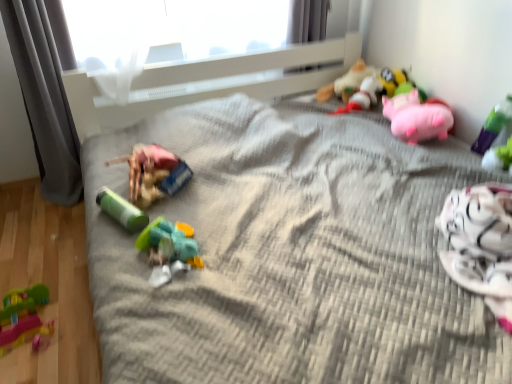
At what (x,y) coordinates should I click in order to perform the action: click on pink plush pig at upper right, which is the third toy in right-to-left order. Please return your answer as a coordinate pair (x, y). Looking at the image, I should click on (417, 117).

What do you see at coordinates (44, 99) in the screenshot?
I see `gray fabric curtain at left, which is the first curtain in left-to-right order` at bounding box center [44, 99].

Identify the location of green plastic toy at center-left, which is counted as the 2th toy, starting from the left. (121, 210).

This screenshot has height=384, width=512. Identify the location of pink plush pig at upper right, placed as the 5th toy when sorted from left to right. (417, 117).

Does pink plush pig at upper right, placed as the 5th toy when sorted from left to right, have a lesser height compared to green plastic toy at center-left, acting as the 6th toy starting from the right?

In fact, pink plush pig at upper right, placed as the 5th toy when sorted from left to right, may be taller than green plastic toy at center-left, acting as the 6th toy starting from the right.

Locate an element on the screen. The width and height of the screenshot is (512, 384). toy that is the 3rd one when counting upward from the green plastic toy at center-left, which is counted as the 2th toy, starting from the left (from the image's perspective) is located at coordinates (417, 117).

Is pink plush pig at upper right, placed as the 5th toy when sorted from left to right, inside the boundaries of green plastic toy at upper right, marked as the 7th toy in a left-to-right arrangement, or outside?

pink plush pig at upper right, placed as the 5th toy when sorted from left to right, is located beyond the bounds of green plastic toy at upper right, marked as the 7th toy in a left-to-right arrangement.

Looking at this image, does pink plush pig at upper right, placed as the 5th toy when sorted from left to right, have a lesser width compared to green plastic toy at upper right, arranged as the 1th toy when viewed from the right?

Incorrect, the width of pink plush pig at upper right, placed as the 5th toy when sorted from left to right, is not less than that of green plastic toy at upper right, arranged as the 1th toy when viewed from the right.

Is point (396, 112) closer or farther from the camera than point (475, 143)?

Point (396, 112) is positioned farther from the camera compared to point (475, 143).

Which object is positioned more to the left, pink plush pig at upper right, placed as the 5th toy when sorted from left to right, or green plastic toy at upper right, marked as the 7th toy in a left-to-right arrangement?

pink plush pig at upper right, placed as the 5th toy when sorted from left to right.

The width and height of the screenshot is (512, 384). I want to click on curtain that is the 2nd object above the rubberized green and pink toy at lower left, which appears as the 7th toy when viewed from the right (from a real-world perspective), so click(x=307, y=21).

Is rubberized green and pink toy at lower left, which appears as the 7th toy when viewed from the right, bigger or smaller than gray fabric curtain at upper center, the 1th curtain when ordered from right to left?

Considering their sizes, rubberized green and pink toy at lower left, which appears as the 7th toy when viewed from the right, takes up less space than gray fabric curtain at upper center, the 1th curtain when ordered from right to left.

Is rubberized green and pink toy at lower left, the 1th toy when ordered from left to right, taller or shorter than gray fabric curtain at upper center, the 1th curtain when ordered from right to left?

rubberized green and pink toy at lower left, the 1th toy when ordered from left to right, is shorter than gray fabric curtain at upper center, the 1th curtain when ordered from right to left.

Which of these two, rubberized green and pink toy at lower left, the 1th toy when ordered from left to right, or gray fabric curtain at upper center, marked as the 2th curtain in a left-to-right arrangement, is wider?

Wider between the two is rubberized green and pink toy at lower left, the 1th toy when ordered from left to right.

Can you confirm if green plastic toy at upper right, arranged as the 1th toy when viewed from the right, is smaller than soft plush bee at upper right, arranged as the 6th toy when viewed from the left?

No.

Looking at this image, how many degrees apart are the facing directions of green plastic toy at upper right, marked as the 7th toy in a left-to-right arrangement, and soft plush bee at upper right, marked as the second toy in a right-to-left arrangement?

green plastic toy at upper right, marked as the 7th toy in a left-to-right arrangement, and soft plush bee at upper right, marked as the second toy in a right-to-left arrangement, are facing 0.858 degrees away from each other.

From the image's perspective, which toy is the 2nd one above the green plastic toy at upper right, marked as the 7th toy in a left-to-right arrangement? Please provide its 2D coordinates.

[(398, 83)]

From the image's perspective, is green plastic toy at upper right, arranged as the 1th toy when viewed from the right, below soft plush bee at upper right, marked as the second toy in a right-to-left arrangement?

Yes, from the image's perspective, green plastic toy at upper right, arranged as the 1th toy when viewed from the right, is beneath soft plush bee at upper right, marked as the second toy in a right-to-left arrangement.

Considering the positions of point (357, 78) and point (483, 130), is point (357, 78) closer or farther from the camera than point (483, 130)?

Point (357, 78).

From the image's perspective, would you say soft plush toy at upper right, the fourth toy when ordered from right to left, is shown under green plastic toy at upper right, marked as the 7th toy in a left-to-right arrangement?

No, from the image's perspective, soft plush toy at upper right, the fourth toy when ordered from right to left, is not beneath green plastic toy at upper right, marked as the 7th toy in a left-to-right arrangement.

Is soft plush toy at upper right, the fourth toy when ordered from right to left, bigger than green plastic toy at upper right, arranged as the 1th toy when viewed from the right?

Yes.

Is green plastic toy at upper right, arranged as the 1th toy when viewed from the right, a part of soft plush toy at upper right, the fourth toy when ordered from right to left?

No.

From a real-world perspective, does soft plush bee at upper right, arranged as the 6th toy when viewed from the left, sit lower than gray fabric curtain at left, which is the first curtain in left-to-right order?

Yes.

Can you tell me how much soft plush bee at upper right, marked as the second toy in a right-to-left arrangement, and gray fabric curtain at left, which appears as the 2th curtain when viewed from the right, differ in facing direction?

There is a 91-degree angle between the facing directions of soft plush bee at upper right, marked as the second toy in a right-to-left arrangement, and gray fabric curtain at left, which appears as the 2th curtain when viewed from the right.

From the image's perspective, is soft plush bee at upper right, marked as the second toy in a right-to-left arrangement, located beneath gray fabric curtain at left, which is the first curtain in left-to-right order?

No.

Between soft plush bee at upper right, marked as the second toy in a right-to-left arrangement, and gray fabric curtain at left, which is the first curtain in left-to-right order, which one has smaller width?

Thinner between the two is soft plush bee at upper right, marked as the second toy in a right-to-left arrangement.

From the image's perspective, which one is positioned lower, rubber duck at center, the fifth toy viewed from the right, or soft plush toy at upper right, the fourth toy when ordered from right to left?

rubber duck at center, the fifth toy viewed from the right, appears lower in the image.

Which point is more distant from viewer, [145,169] or [319,97]?

The point [319,97] is behind.

Does rubber duck at center, the fifth toy viewed from the right, turn towards soft plush toy at upper right, the fourth toy when ordered from right to left?

No, rubber duck at center, the fifth toy viewed from the right, is not turned towards soft plush toy at upper right, the fourth toy when ordered from right to left.

Would you say rubber duck at center, the fifth toy viewed from the right, is outside soft plush toy at upper right, the fourth toy when ordered from right to left?

Indeed, rubber duck at center, the fifth toy viewed from the right, is completely outside soft plush toy at upper right, the fourth toy when ordered from right to left.

Where is `toy that is the 3rd object to the left of the pink plush pig at upper right, placed as the 5th toy when sorted from left to right, starting at the anchor`? toy that is the 3rd object to the left of the pink plush pig at upper right, placed as the 5th toy when sorted from left to right, starting at the anchor is located at coordinates (121, 210).

Where is `the 1st toy in front of the pink plush pig at upper right, placed as the 5th toy when sorted from left to right, counting from the anchor's position`? This screenshot has width=512, height=384. the 1st toy in front of the pink plush pig at upper right, placed as the 5th toy when sorted from left to right, counting from the anchor's position is located at coordinates (493, 125).

Looking at the image, which one is located further to gray fabric curtain at upper center, marked as the 2th curtain in a left-to-right arrangement, rubberized green and pink toy at lower left, the 1th toy when ordered from left to right, or green plastic toy at center-left, which is counted as the 2th toy, starting from the left?

The object further to gray fabric curtain at upper center, marked as the 2th curtain in a left-to-right arrangement, is rubberized green and pink toy at lower left, the 1th toy when ordered from left to right.

Considering their positions, is gray fabric curtain at left, which appears as the 2th curtain when viewed from the right, positioned further to pink plush pig at upper right, which is the third toy in right-to-left order, than soft plush bee at upper right, arranged as the 6th toy when viewed from the left?

Among the two, gray fabric curtain at left, which appears as the 2th curtain when viewed from the right, is located further to pink plush pig at upper right, which is the third toy in right-to-left order.

Which object lies nearer to the anchor point green plastic toy at center-left, which is counted as the 2th toy, starting from the left, rubberized green and pink toy at lower left, the 1th toy when ordered from left to right, or gray fabric curtain at left, which is the first curtain in left-to-right order?

rubberized green and pink toy at lower left, the 1th toy when ordered from left to right, is closer to green plastic toy at center-left, which is counted as the 2th toy, starting from the left.

When comparing their distances from rubberized green and pink toy at lower left, the 1th toy when ordered from left to right, does gray fabric curtain at left, which appears as the 2th curtain when viewed from the right, or soft plush bee at upper right, arranged as the 6th toy when viewed from the left, seem closer?

gray fabric curtain at left, which appears as the 2th curtain when viewed from the right, is closer to rubberized green and pink toy at lower left, the 1th toy when ordered from left to right.

Which object lies further to the anchor point gray fabric curtain at upper center, marked as the 2th curtain in a left-to-right arrangement, soft plush bee at upper right, marked as the second toy in a right-to-left arrangement, or rubber duck at center, acting as the third toy starting from the left?

rubber duck at center, acting as the third toy starting from the left, is further to gray fabric curtain at upper center, marked as the 2th curtain in a left-to-right arrangement.

Estimate the real-world distances between objects in this image. Which object is further from green plastic toy at center-left, which is counted as the 2th toy, starting from the left, soft plush toy at upper right, which ranks as the 4th toy in left-to-right order, or pink plush pig at upper right, which is the third toy in right-to-left order?

Based on the image, soft plush toy at upper right, which ranks as the 4th toy in left-to-right order, appears to be further to green plastic toy at center-left, which is counted as the 2th toy, starting from the left.

Based on their spatial positions, is gray fabric curtain at left, which is the first curtain in left-to-right order, or pink plush pig at upper right, which is the third toy in right-to-left order, closer to gray fabric curtain at upper center, marked as the 2th curtain in a left-to-right arrangement?

pink plush pig at upper right, which is the third toy in right-to-left order, is positioned closer to the anchor gray fabric curtain at upper center, marked as the 2th curtain in a left-to-right arrangement.

Which object lies nearer to the anchor point green plastic toy at upper right, marked as the 7th toy in a left-to-right arrangement, gray fabric curtain at upper center, marked as the 2th curtain in a left-to-right arrangement, or soft plush bee at upper right, arranged as the 6th toy when viewed from the left?

Result: Among the two, soft plush bee at upper right, arranged as the 6th toy when viewed from the left, is located nearer to green plastic toy at upper right, marked as the 7th toy in a left-to-right arrangement.

What are the coordinates of `curtain located between rubber duck at center, acting as the third toy starting from the left, and soft plush toy at upper right, which ranks as the 4th toy in left-to-right order, in the left-right direction` in the screenshot? It's located at (307, 21).

The width and height of the screenshot is (512, 384). In order to click on curtain located between pink plush pig at upper right, which is the third toy in right-to-left order, and soft plush toy at upper right, the fourth toy when ordered from right to left, in the depth direction in this screenshot , I will do `click(307, 21)`.

This screenshot has width=512, height=384. Identify the location of toy situated between rubber duck at center, acting as the third toy starting from the left, and pink plush pig at upper right, placed as the 5th toy when sorted from left to right, from left to right. (346, 80).

In order to click on curtain located between green plastic toy at center-left, which is counted as the 2th toy, starting from the left, and green plastic toy at upper right, marked as the 7th toy in a left-to-right arrangement, in the left-right direction in this screenshot , I will do pyautogui.click(x=307, y=21).